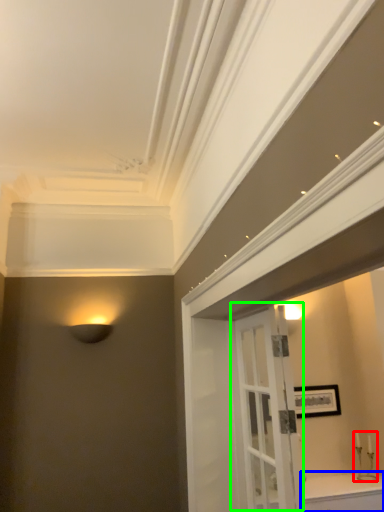
Question: Based on their relative distances, which object is farther from candle holder (highlighted by a red box)? Choose from cabinetry (highlighted by a blue box) and door (highlighted by a green box).

Choices:
 (A) cabinetry
 (B) door

Answer: (B)